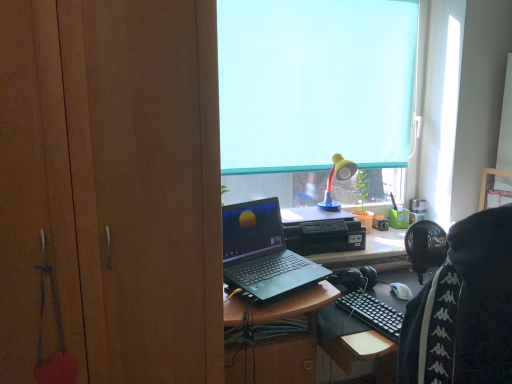
Locate an element on the screen. Image resolution: width=512 pixels, height=384 pixels. blue fabric at upper center is located at coordinates (315, 83).

Identify the location of wooden cabinet at left. (112, 186).

This screenshot has height=384, width=512. What are the coordinates of `yellow matte lamp at upper center` in the screenshot? It's located at (337, 179).

Considering the positions of point (356, 164) and point (224, 235), is point (356, 164) closer or farther from the camera than point (224, 235)?

Point (356, 164) appears to be farther away from the viewer than point (224, 235).

In the image, there is a yellow matte lamp at upper center. Find the location of `laptop below it (from the image's perspective)`. laptop below it (from the image's perspective) is located at coordinates (262, 254).

What's the angular difference between yellow matte lamp at upper center and black matte laptop at center's facing directions?

The facing directions of yellow matte lamp at upper center and black matte laptop at center are 22.7 degrees apart.

Is yellow matte lamp at upper center thinner than black matte laptop at center?

Yes.

From their relative heights in the image, would you say yellow matte lamp at upper center is taller or shorter than blue fabric at upper center?

Clearly, yellow matte lamp at upper center is shorter compared to blue fabric at upper center.

Is yellow matte lamp at upper center smaller than blue fabric at upper center?

Yes, yellow matte lamp at upper center is smaller than blue fabric at upper center.

How different are the orientations of yellow matte lamp at upper center and blue fabric at upper center in degrees?

The angular difference between yellow matte lamp at upper center and blue fabric at upper center is 1.25 degrees.

From a real-world perspective, relative to blue fabric at upper center, is yellow matte lamp at upper center vertically above or below?

From a real-world perspective, yellow matte lamp at upper center is physically below blue fabric at upper center.

Between blue fabric at upper center and wooden cabinet at left, which one has more height?

With more height is wooden cabinet at left.

Considering the sizes of objects blue fabric at upper center and wooden cabinet at left in the image provided, who is thinner, blue fabric at upper center or wooden cabinet at left?

blue fabric at upper center.

Is blue fabric at upper center smaller than wooden cabinet at left?

Correct, blue fabric at upper center occupies less space than wooden cabinet at left.

Is black matte laptop at center far from blue fabric at upper center?

Actually, black matte laptop at center and blue fabric at upper center are a little close together.

Visually, is black matte laptop at center positioned to the left or to the right of blue fabric at upper center?

black matte laptop at center is to the left of blue fabric at upper center.

Which object is wider, black matte laptop at center or blue fabric at upper center?

black matte laptop at center is wider.

From the image's perspective, is black matte laptop at center positioned above or below blue fabric at upper center?

black matte laptop at center is below blue fabric at upper center.

Considering the sizes of objects wooden cabinet at left and black matte laptop at center in the image provided, who is shorter, wooden cabinet at left or black matte laptop at center?

black matte laptop at center is shorter.

Between wooden cabinet at left and black matte laptop at center, which one has smaller size?

With smaller size is black matte laptop at center.

What's the angular difference between wooden cabinet at left and black matte laptop at center's facing directions?

The facing directions of wooden cabinet at left and black matte laptop at center are 24.4 degrees apart.

Consider the image. From a real-world perspective, is blue fabric at upper center above or below yellow matte lamp at upper center?

In terms of real-world spatial position, blue fabric at upper center is above yellow matte lamp at upper center.

Is blue fabric at upper center at the right side of yellow matte lamp at upper center?

Incorrect, blue fabric at upper center is not on the right side of yellow matte lamp at upper center.

Consider the image. Can you confirm if blue fabric at upper center is thinner than yellow matte lamp at upper center?

Correct, the width of blue fabric at upper center is less than that of yellow matte lamp at upper center.

Does black matte laptop at center come in front of wooden cabinet at left?

That is False.

You are a GUI agent. You are given a task and a screenshot of the screen. Output one action in this format:
    pyautogui.click(x=<x>, y=<y>)
    Task: Click on the laptop below the wooden cabinet at left (from the image's perspective)
    The width and height of the screenshot is (512, 384).
    Given the screenshot: What is the action you would take?
    pyautogui.click(x=262, y=254)

In terms of size, does black matte laptop at center appear bigger or smaller than wooden cabinet at left?

Clearly, black matte laptop at center is smaller in size than wooden cabinet at left.

From the image's perspective, is black matte laptop at center located above wooden cabinet at left?

Incorrect, from the image's perspective, black matte laptop at center is lower than wooden cabinet at left.

Identify the location of laptop on the left of yellow matte lamp at upper center. This screenshot has width=512, height=384. (262, 254).

Locate an element on the screen. This screenshot has width=512, height=384. window screen above the yellow matte lamp at upper center (from the image's perspective) is located at coordinates (315, 83).

From the image, which object appears to be nearer to black matte laptop at center, blue fabric at upper center or yellow matte lamp at upper center?

yellow matte lamp at upper center.

Estimate the real-world distances between objects in this image. Which object is closer to yellow matte lamp at upper center, black matte laptop at center or wooden cabinet at left?

black matte laptop at center.

Looking at this image, when comparing their distances from blue fabric at upper center, does yellow matte lamp at upper center or wooden cabinet at left seem further?

The object further to blue fabric at upper center is wooden cabinet at left.

From the image, which object appears to be farther from wooden cabinet at left, black matte laptop at center or blue fabric at upper center?

blue fabric at upper center lies further to wooden cabinet at left than the other object.

When comparing their distances from black matte laptop at center, does yellow matte lamp at upper center or wooden cabinet at left seem further?

yellow matte lamp at upper center is further to black matte laptop at center.

When comparing their distances from yellow matte lamp at upper center, does wooden cabinet at left or black matte laptop at center seem further?

The object further to yellow matte lamp at upper center is wooden cabinet at left.

Based on their spatial positions, is wooden cabinet at left or blue fabric at upper center closer to black matte laptop at center?

Based on the image, wooden cabinet at left appears to be nearer to black matte laptop at center.

Estimate the real-world distances between objects in this image. Which object is closer to blue fabric at upper center, yellow matte lamp at upper center or black matte laptop at center?

yellow matte lamp at upper center is positioned closer to the anchor blue fabric at upper center.

Identify the location of laptop located between wooden cabinet at left and yellow matte lamp at upper center in the depth direction. The height and width of the screenshot is (384, 512). (262, 254).

At what (x,y) coordinates should I click in order to perform the action: click on window screen located between wooden cabinet at left and yellow matte lamp at upper center in the depth direction. Please return your answer as a coordinate pair (x, y). The image size is (512, 384). Looking at the image, I should click on (315, 83).

I want to click on laptop between wooden cabinet at left and blue fabric at upper center in the front-back direction, so pos(262,254).

At what (x,y) coordinates should I click in order to perform the action: click on lamp that lies between blue fabric at upper center and black matte laptop at center from top to bottom. Please return your answer as a coordinate pair (x, y). The height and width of the screenshot is (384, 512). Looking at the image, I should click on (337, 179).